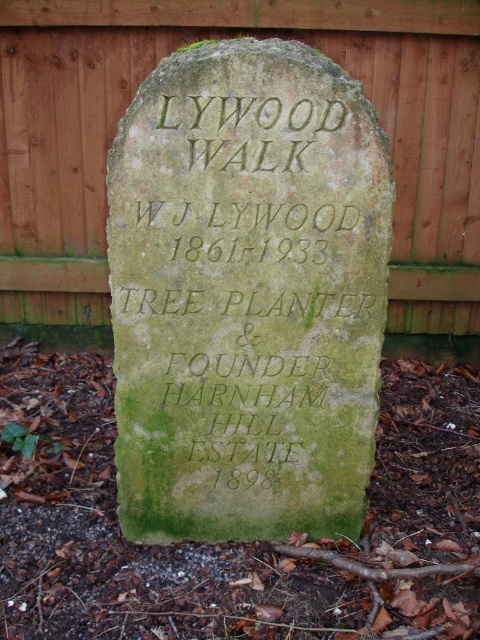
You are a landscape architect designing a garden path that needs to pass between the green mossy stone at center and the wooden fence at upper center. Considering their heights, which object might block the view of the other when viewed from the path? Please explain your reasoning.

The green mossy stone at center is much taller than the wooden fence at upper center, so it might block the view of the wooden fence at upper center when viewed from the path.

You are a gardener who wants to place a new 1.5 meter wide decorative stone between the green mossy stone at center and the wooden fence at upper center. Is there enough space for it?

The distance between the green mossy stone at center and the wooden fence at upper center is 1.33 meters. Since the decorative stone is 1.5 meters wide, there isn not enough space to place it between them.